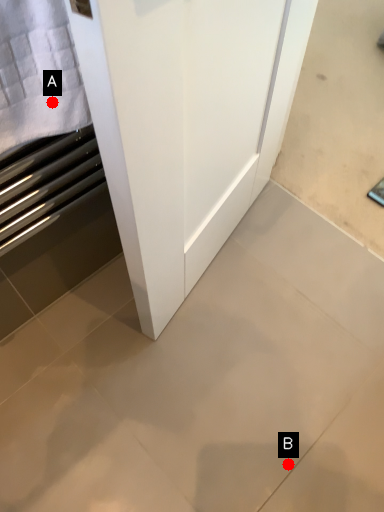
Question: Two points are circled on the image, labeled by A and B beside each circle. Which point is closer to the camera taking this photo?

Choices:
 (A) A is closer
 (B) B is closer

Answer: (A)